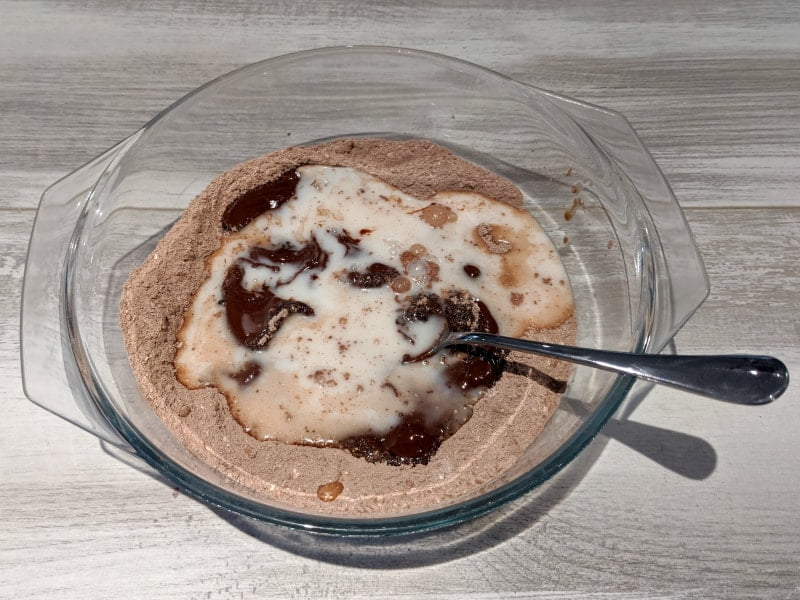
This screenshot has width=800, height=600. What are the coordinates of `spoon` in the screenshot? It's located at (680, 366).